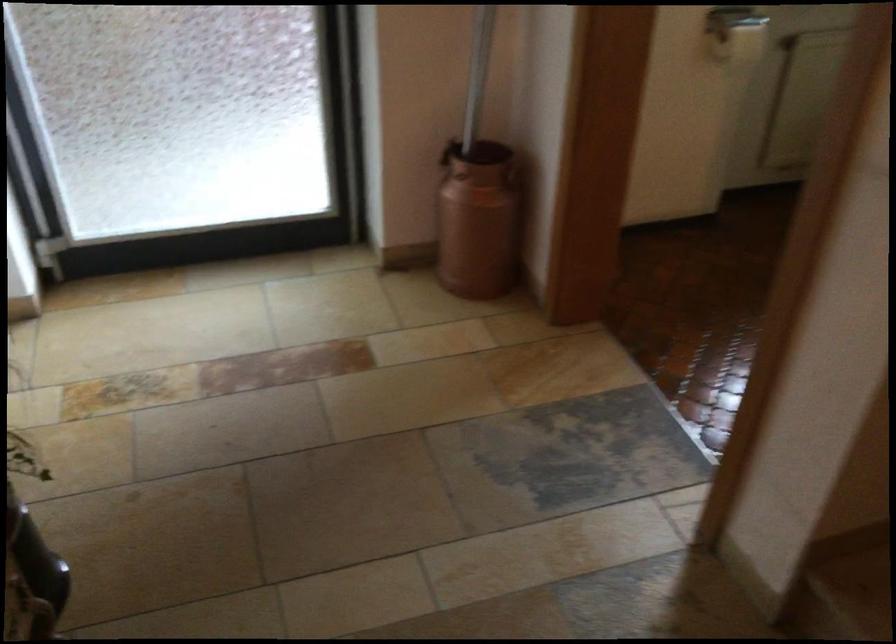
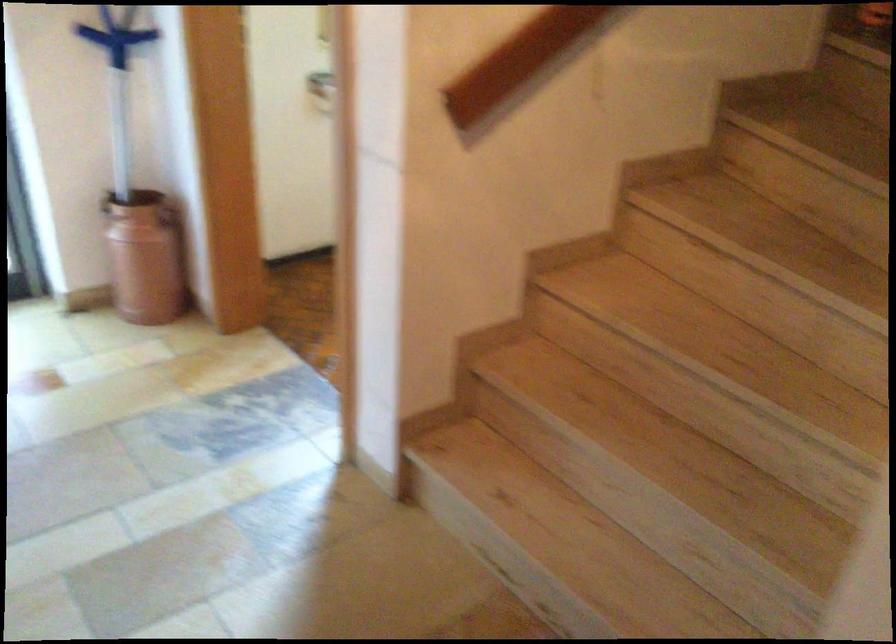
In a continuous first-person perspective shot, in which direction is the camera moving?

The cameraman walked toward right, backward.